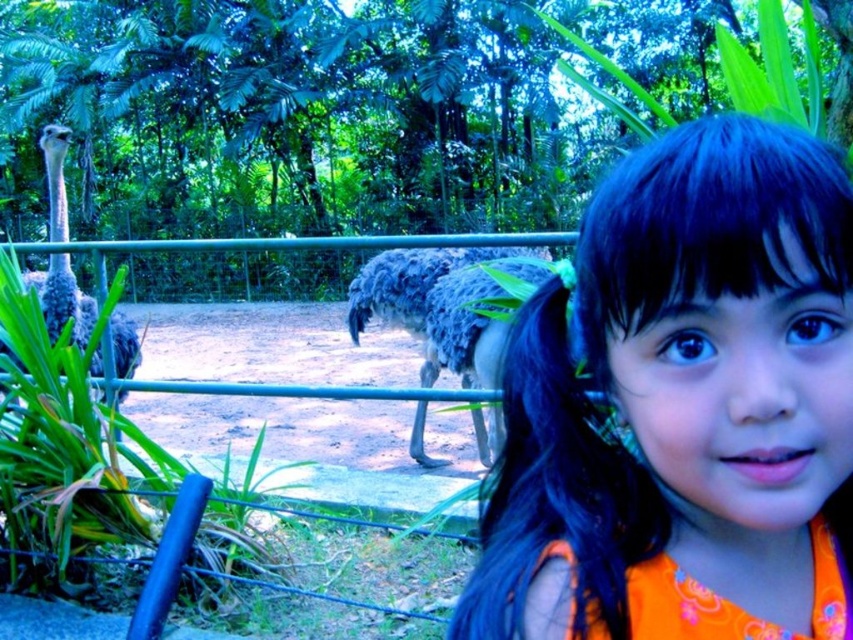
Question: Which point appears farthest from the camera in this image?

Choices:
 (A) (80, 310)
 (B) (425, 292)

Answer: (B)

Question: Which of the following is the farthest from the observer?

Choices:
 (A) gray feathered ostrich at left
 (B) blue hair at upper right

Answer: (A)

Question: In this image, where is blue hair at upper right located relative to gray feathered ostrich at left?

Choices:
 (A) above
 (B) below

Answer: (A)

Question: Is blue hair at upper right to the right of gray feathered ostrich at center from the viewer's perspective?

Choices:
 (A) yes
 (B) no

Answer: (A)

Question: Which point is closer to the camera taking this photo?

Choices:
 (A) (471, 330)
 (B) (61, 323)
 (C) (647, 547)

Answer: (C)

Question: Is blue hair at upper right positioned before gray feathered ostrich at left?

Choices:
 (A) yes
 (B) no

Answer: (A)